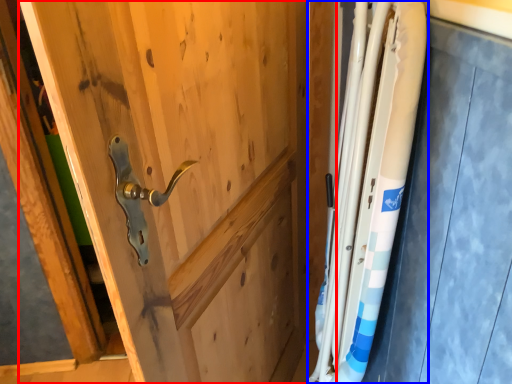
Question: Which object is further to the camera taking this photo, door (highlighted by a red box) or steel (highlighted by a blue box)?

Choices:
 (A) door
 (B) steel

Answer: (B)